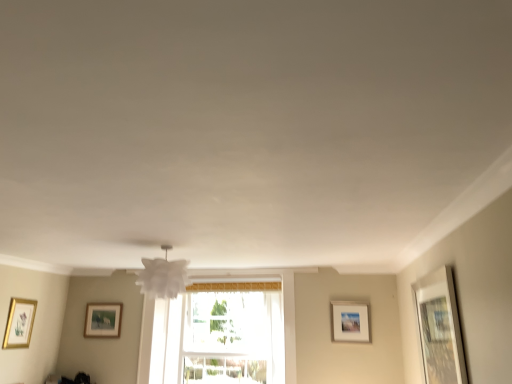
Question: Does matte wooden picture frame at lower left, the first picture frame from the back, appear on the right side of white matte picture frame at upper right, the second picture frame in the back-to-front sequence?

Choices:
 (A) yes
 (B) no

Answer: (B)

Question: Is matte wooden picture frame at lower left, which is the 2th picture frame from left to right, smaller than white matte picture frame at upper right, placed as the 3th picture frame when sorted from left to right?

Choices:
 (A) no
 (B) yes

Answer: (B)

Question: Does matte wooden picture frame at lower left, the third picture frame positioned from the right, have a lesser height compared to white matte picture frame at upper right, the second picture frame in the back-to-front sequence?

Choices:
 (A) yes
 (B) no

Answer: (A)

Question: From a real-world perspective, is matte wooden picture frame at lower left, which is the 4th picture frame in front-to-back order, located beneath white matte picture frame at upper right, the 2th picture frame when ordered from right to left?

Choices:
 (A) yes
 (B) no

Answer: (B)

Question: Can we say matte wooden picture frame at lower left, which is the 4th picture frame in front-to-back order, lies outside white matte picture frame at upper right, the 2th picture frame when ordered from right to left?

Choices:
 (A) no
 (B) yes

Answer: (B)

Question: From the image's perspective, is matte wooden picture frame at lower left, the third picture frame positioned from the right, located beneath white matte picture frame at upper right, the 3th picture frame positioned from the front?

Choices:
 (A) no
 (B) yes

Answer: (B)

Question: Does white paper lampshade at center have a lesser width compared to transparent glass window at center?

Choices:
 (A) yes
 (B) no

Answer: (B)

Question: Is the surface of white paper lampshade at center in direct contact with transparent glass window at center?

Choices:
 (A) no
 (B) yes

Answer: (A)

Question: Is white paper lampshade at center not near transparent glass window at center?

Choices:
 (A) yes
 (B) no

Answer: (A)

Question: From a real-world perspective, is white paper lampshade at center physically above transparent glass window at center?

Choices:
 (A) no
 (B) yes

Answer: (B)

Question: Is white paper lampshade at center oriented away from transparent glass window at center?

Choices:
 (A) yes
 (B) no

Answer: (A)

Question: From the image's perspective, is white paper lampshade at center under transparent glass window at center?

Choices:
 (A) no
 (B) yes

Answer: (A)

Question: Would you say white matte picture frame at upper right, the second picture frame in the back-to-front sequence, is outside gold-framed picture at left, the 4th picture frame from the right?

Choices:
 (A) yes
 (B) no

Answer: (A)